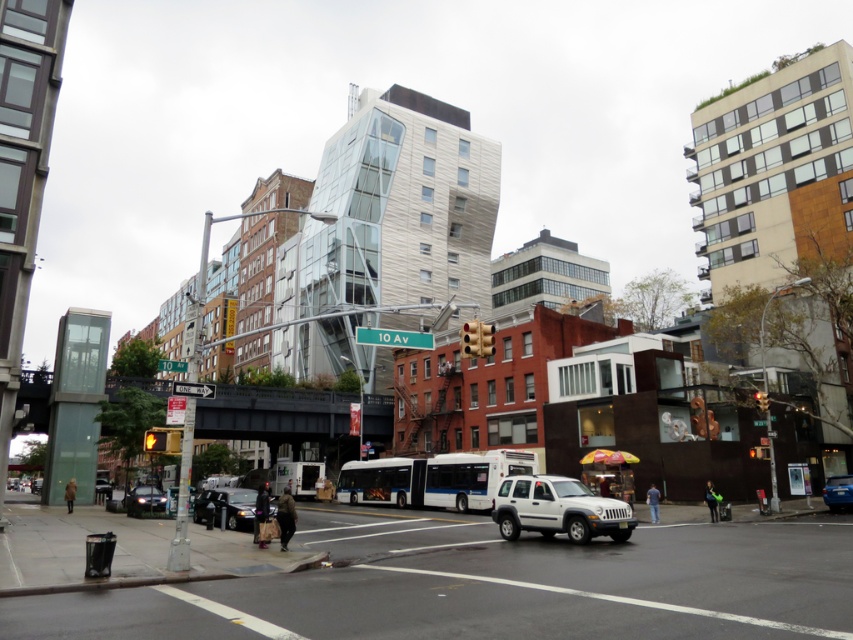
Who is taller, white matte suv at center or shiny black sedan at lower left?

Standing taller between the two is white matte suv at center.

Does point (511, 512) come closer to viewer compared to point (254, 493)?

Yes, point (511, 512) is closer to viewer.

Find the location of `white matte suv at center`. white matte suv at center is located at coordinates (558, 509).

In the scene shown: Does white matte suv at center lie behind red glass traffic light at center?

Yes, white matte suv at center is further from the viewer.

Between white matte suv at center and red glass traffic light at center, which one appears on the right side from the viewer's perspective?

white matte suv at center is more to the right.

Is point (584, 488) less distant than point (474, 317)?

Yes, it is in front of point (474, 317).

The height and width of the screenshot is (640, 853). Find the location of `white matte suv at center`. white matte suv at center is located at coordinates (558, 509).

Is shiny black sedan at lower left to the left of shiny black sedan at center from the viewer's perspective?

In fact, shiny black sedan at lower left is to the right of shiny black sedan at center.

Find the location of a particular element. This screenshot has height=640, width=853. shiny black sedan at lower left is located at coordinates click(x=225, y=506).